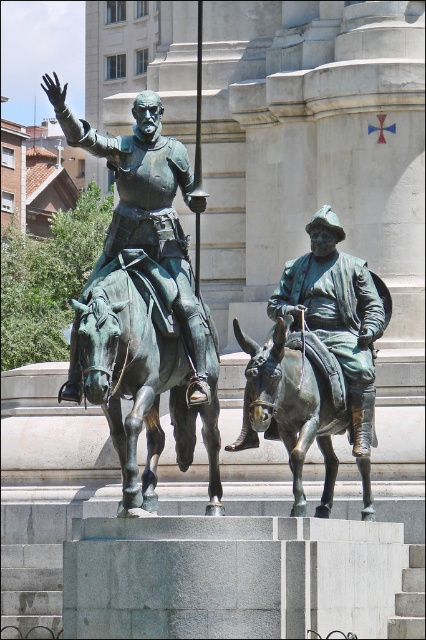
Question: Estimate the real-world distances between objects in this image. Which object is farther from the bronze statue of man at center?

Choices:
 (A) bronze/greenish metal horse at center-left
 (B) bronze statue of man on horse at upper center

Answer: (B)

Question: Which of the following is the closest to the observer?

Choices:
 (A) (322, 220)
 (B) (268, 412)
 (C) (184, 435)
 (D) (138, 148)

Answer: (B)

Question: Does bronze statue of man at center have a lesser width compared to bronze donkey at center?

Choices:
 (A) yes
 (B) no

Answer: (B)

Question: Can you confirm if bronze/greenish metal horse at center-left is positioned to the right of bronze statue of man at center?

Choices:
 (A) no
 (B) yes

Answer: (A)

Question: Which point is farther to the camera?

Choices:
 (A) bronze statue of man on horse at upper center
 (B) bronze/greenish metal horse at center-left

Answer: (A)

Question: Does bronze statue of man on horse at upper center appear on the left side of bronze statue of man at center?

Choices:
 (A) yes
 (B) no

Answer: (A)